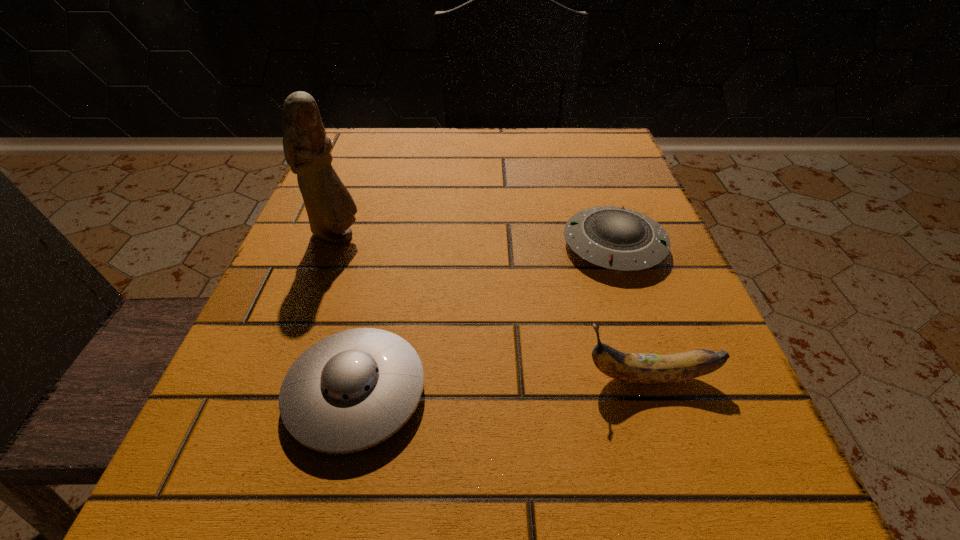
Image resolution: width=960 pixels, height=540 pixels. In order to click on vacant space located on the right of the nearer saucer in this screenshot , I will do [584, 392].

The image size is (960, 540). Find the location of `free spot located on the left of the right saucer`. free spot located on the left of the right saucer is located at coordinates (534, 245).

This screenshot has height=540, width=960. Identify the location of figurine located at the left edge. (330, 207).

I want to click on saucer that is positioned at the left edge, so click(352, 390).

Find the location of a particular element. banana present at the right edge is located at coordinates (634, 368).

You are a GUI agent. You are given a task and a screenshot of the screen. Output one action in this format:
    pyautogui.click(x=<x>, y=<y>)
    Task: Click on the saucer that is at the right edge
    
    Given the screenshot: What is the action you would take?
    616,238

At what (x,y) coordinates should I click in order to perform the action: click on free region at the far edge. Please return your answer as a coordinate pair (x, y). The width and height of the screenshot is (960, 540). Looking at the image, I should click on (436, 166).

What are the coordinates of `vacant region at the near edge of the desktop` in the screenshot? It's located at (575, 508).

Locate an element on the screen. The width and height of the screenshot is (960, 540). vacant space at the left edge of the desktop is located at coordinates (378, 187).

The height and width of the screenshot is (540, 960). I want to click on vacant area at the right edge of the desktop, so click(x=604, y=289).